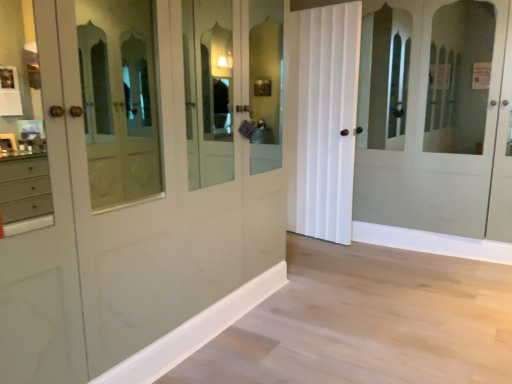
Question: From the image's perspective, is white wood molding at lower center above or below white matte door at center?

Choices:
 (A) below
 (B) above

Answer: (A)

Question: From a real-world perspective, relative to white matte door at center, is white wood molding at lower center vertically above or below?

Choices:
 (A) above
 (B) below

Answer: (B)

Question: Visually, is white wood molding at lower center positioned to the left or to the right of white matte door at center?

Choices:
 (A) left
 (B) right

Answer: (A)

Question: Visually, is white matte door at center positioned to the left or to the right of white wood molding at lower center?

Choices:
 (A) right
 (B) left

Answer: (A)

Question: In terms of size, does white matte door at center appear bigger or smaller than white wood molding at lower center?

Choices:
 (A) small
 (B) big

Answer: (B)

Question: In terms of width, does white matte door at center look wider or thinner when compared to white wood molding at lower center?

Choices:
 (A) thin
 (B) wide

Answer: (B)

Question: From the image's perspective, is white matte door at center located above or below white wood molding at lower center?

Choices:
 (A) above
 (B) below

Answer: (A)